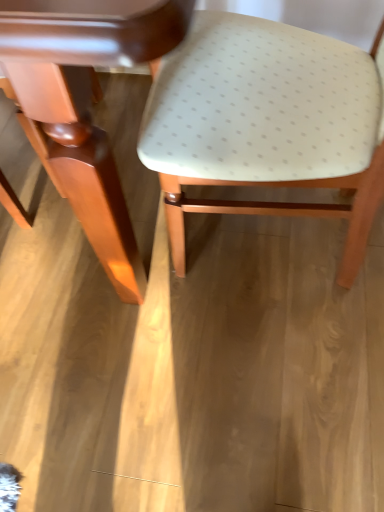
Locate an element on the screen. The height and width of the screenshot is (512, 384). vacant area that is in front of matte white plastic chair at center is located at coordinates (259, 387).